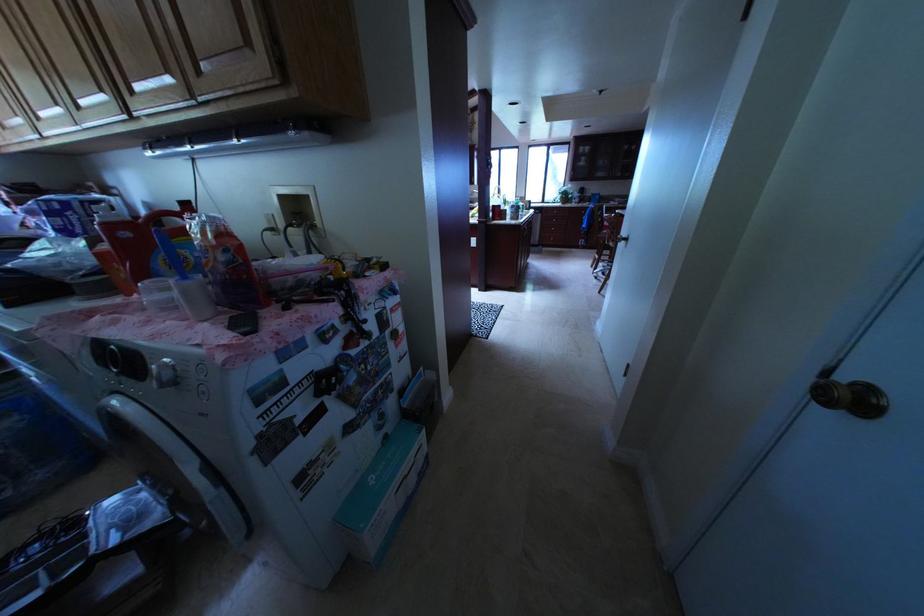
The location [234,272] corresponds to which object?

This point indicates the orange detergent bottle.